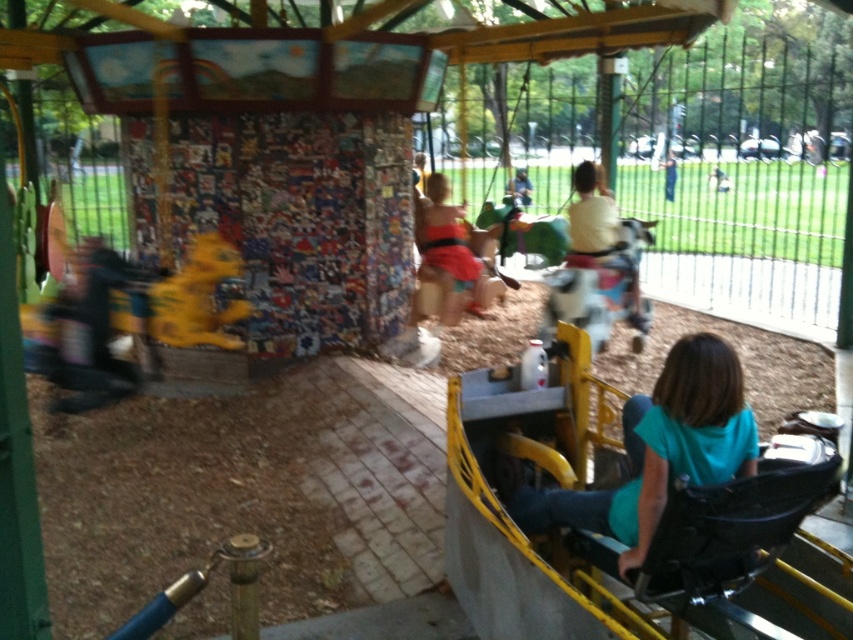
Question: Can you confirm if teal fabric shirt at lower right is positioned to the left of matte yellow plush at center?

Choices:
 (A) no
 (B) yes

Answer: (B)

Question: Among these points, which one is nearest to the camera?

Choices:
 (A) (672, 182)
 (B) (726, 365)
 (C) (460, 243)
 (D) (514, 186)

Answer: (B)

Question: Does matte yellow plush at center come in front of dark blue jeans at center?

Choices:
 (A) no
 (B) yes

Answer: (B)

Question: Can you confirm if matte yellow plush at center is positioned above dark blue jeans at center?

Choices:
 (A) no
 (B) yes

Answer: (A)

Question: Which object appears closest to the camera in this image?

Choices:
 (A) white cotton shirt at center
 (B) matte yellow plush at center
 (C) matte yellow swing at center

Answer: (A)

Question: Which point is closer to the camera?

Choices:
 (A) dark blue jeans at center
 (B) white cotton shirt at center

Answer: (B)